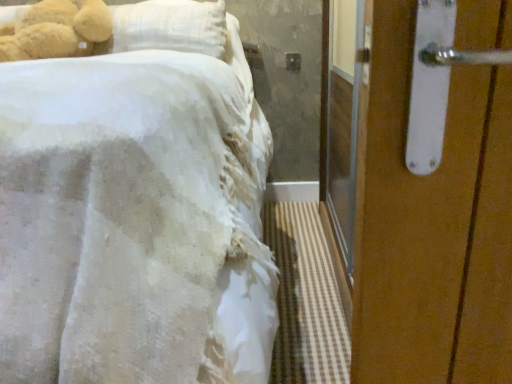
Question: From the image's perspective, is soft plush teddy bear at upper left positioned above or below white matte door handle at upper right?

Choices:
 (A) below
 (B) above

Answer: (B)

Question: From a real-world perspective, relative to white matte door handle at upper right, is soft plush teddy bear at upper left vertically above or below?

Choices:
 (A) below
 (B) above

Answer: (B)

Question: Which is farther from the white matte door handle at upper right?

Choices:
 (A) white fabric bed at left
 (B) soft plush teddy bear at upper left

Answer: (B)

Question: Based on their relative distances, which object is nearer to the white fabric bed at left?

Choices:
 (A) white matte door handle at upper right
 (B) soft plush teddy bear at upper left

Answer: (A)